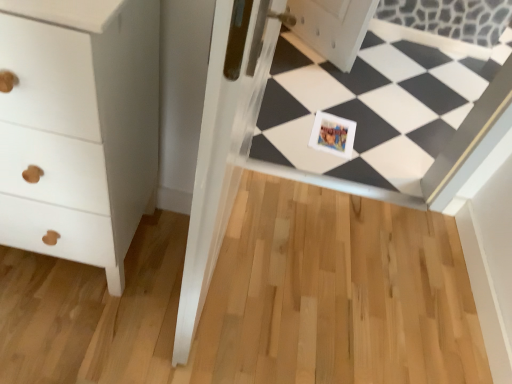
Question: From a real-world perspective, is white glossy frame at center positioned over white matte chest of drawers at left based on gravity?

Choices:
 (A) yes
 (B) no

Answer: (B)

Question: Does white glossy frame at center contain white matte chest of drawers at left?

Choices:
 (A) no
 (B) yes

Answer: (A)

Question: Would you say white glossy frame at center is a long distance from white matte chest of drawers at left?

Choices:
 (A) yes
 (B) no

Answer: (A)

Question: Does white glossy frame at center lie in front of white matte chest of drawers at left?

Choices:
 (A) no
 (B) yes

Answer: (A)

Question: Does white glossy frame at center have a larger size compared to white matte chest of drawers at left?

Choices:
 (A) no
 (B) yes

Answer: (A)

Question: Looking at the image, does white matte chest of drawers at left seem bigger or smaller compared to white glossy frame at center?

Choices:
 (A) small
 (B) big

Answer: (B)

Question: Is white matte chest of drawers at left situated inside white glossy frame at center or outside?

Choices:
 (A) inside
 (B) outside

Answer: (B)

Question: Considering the positions of white matte chest of drawers at left and white glossy frame at center in the image, is white matte chest of drawers at left taller or shorter than white glossy frame at center?

Choices:
 (A) tall
 (B) short

Answer: (A)

Question: From the image's perspective, is white matte chest of drawers at left positioned above or below white glossy frame at center?

Choices:
 (A) above
 (B) below

Answer: (B)

Question: In terms of height, does printed paper postcard at center look taller or shorter compared to white glossy frame at center?

Choices:
 (A) short
 (B) tall

Answer: (A)

Question: In terms of width, does printed paper postcard at center look wider or thinner when compared to white glossy frame at center?

Choices:
 (A) wide
 (B) thin

Answer: (A)

Question: Considering their positions, is printed paper postcard at center located in front of or behind white glossy frame at center?

Choices:
 (A) behind
 (B) front

Answer: (A)

Question: Is printed paper postcard at center bigger or smaller than white glossy frame at center?

Choices:
 (A) small
 (B) big

Answer: (A)

Question: From the image's perspective, is white glossy frame at center above or below white matte chest of drawers at left?

Choices:
 (A) above
 (B) below

Answer: (A)

Question: Choose the correct answer: Is white glossy frame at center inside white matte chest of drawers at left or outside it?

Choices:
 (A) inside
 (B) outside

Answer: (B)